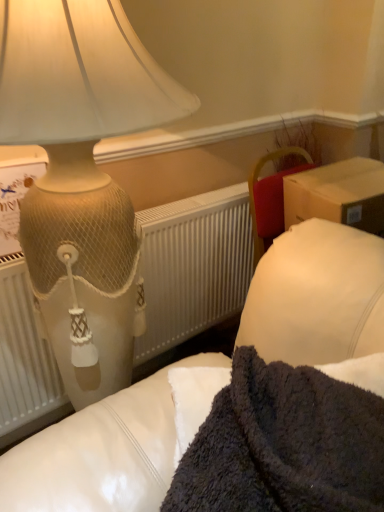
Question: Would you consider matte cream lamp at upper left to be distant from dark fuzzy blanket at lower right?

Choices:
 (A) no
 (B) yes

Answer: (A)

Question: Can you confirm if matte cream lamp at upper left is smaller than dark fuzzy blanket at lower right?

Choices:
 (A) no
 (B) yes

Answer: (A)

Question: Would you say matte cream lamp at upper left contains dark fuzzy blanket at lower right?

Choices:
 (A) yes
 (B) no

Answer: (B)

Question: From the image's perspective, is matte cream lamp at upper left above dark fuzzy blanket at lower right?

Choices:
 (A) yes
 (B) no

Answer: (A)

Question: Is matte cream lamp at upper left in contact with dark fuzzy blanket at lower right?

Choices:
 (A) yes
 (B) no

Answer: (B)

Question: From the image's perspective, is matte cream lamp at upper left below dark fuzzy blanket at lower right?

Choices:
 (A) no
 (B) yes

Answer: (A)

Question: From the image's perspective, would you say matte cream lamp at upper left is shown under white textured radiator at left?

Choices:
 (A) no
 (B) yes

Answer: (A)

Question: From a real-world perspective, is matte cream lamp at upper left on top of white textured radiator at left?

Choices:
 (A) yes
 (B) no

Answer: (A)

Question: From a real-world perspective, does matte cream lamp at upper left sit lower than white textured radiator at left?

Choices:
 (A) no
 (B) yes

Answer: (A)

Question: Does matte cream lamp at upper left appear on the right side of white textured radiator at left?

Choices:
 (A) no
 (B) yes

Answer: (A)

Question: Can you confirm if matte cream lamp at upper left is positioned to the left of white textured radiator at left?

Choices:
 (A) no
 (B) yes

Answer: (B)

Question: Considering the relative positions of matte cream lamp at upper left and white textured radiator at left in the image provided, is matte cream lamp at upper left behind white textured radiator at left?

Choices:
 (A) no
 (B) yes

Answer: (A)

Question: Is white textured radiator at left placed right next to matte cream lamp at upper left?

Choices:
 (A) yes
 (B) no

Answer: (B)